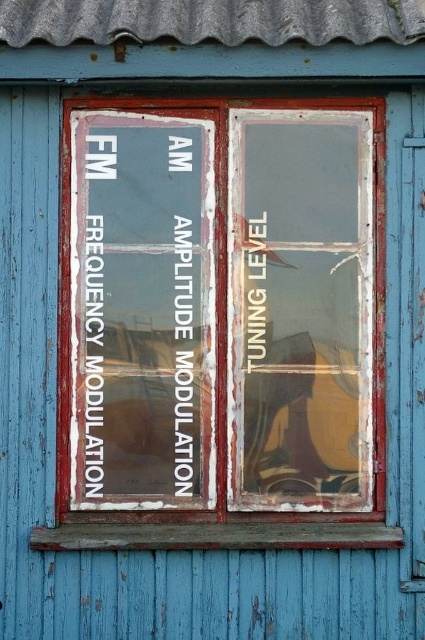
Question: Is chipped paint window at center positioned behind transparent glass guitar at right?

Choices:
 (A) no
 (B) yes

Answer: (A)

Question: Does chipped paint window at center have a greater width compared to transparent glass guitar at right?

Choices:
 (A) no
 (B) yes

Answer: (B)

Question: Which of the following is the farthest from the observer?

Choices:
 (A) (337, 348)
 (B) (260, 182)

Answer: (A)

Question: Observing the image, what is the correct spatial positioning of chipped paint window at center in reference to transparent glass guitar at right?

Choices:
 (A) left
 (B) right

Answer: (A)

Question: Which point is farther to the camera?

Choices:
 (A) (201, 364)
 (B) (345, 458)

Answer: (B)